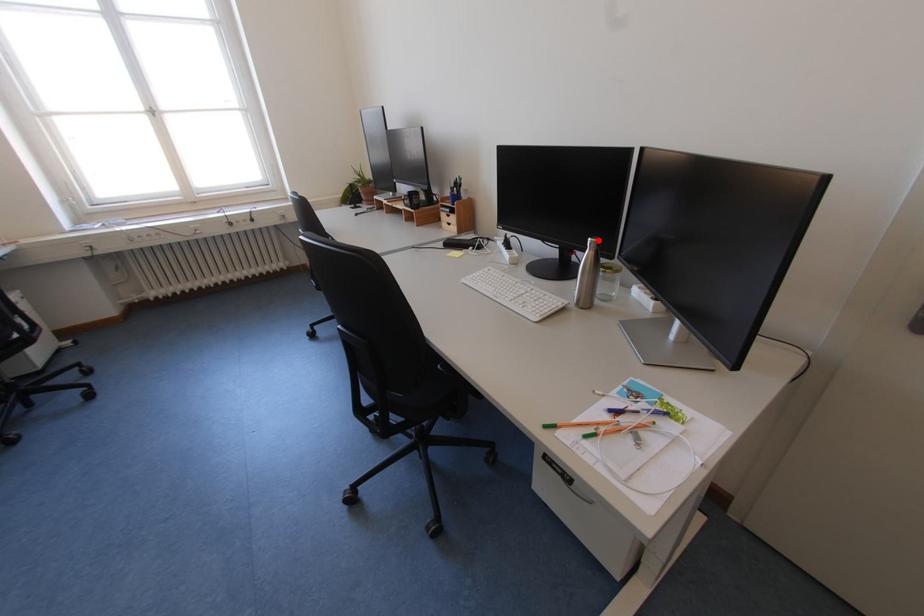
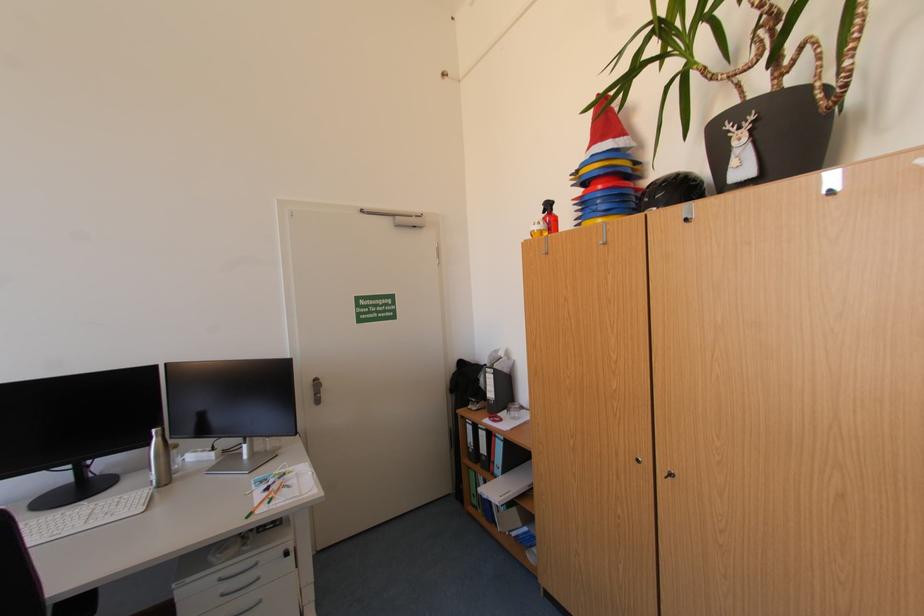
The point at the highlighted location is marked in the first image. Where is the corresponding point in the second image?

(161, 431)